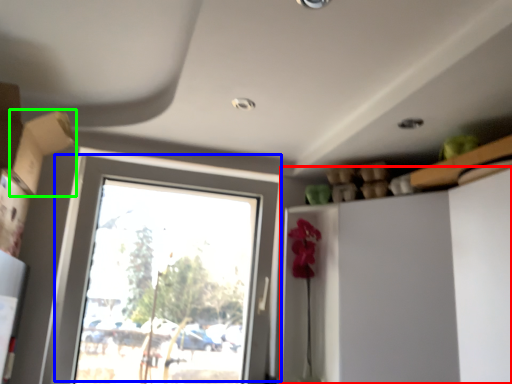
Question: Based on their relative distances, which object is nearer to dresser (highlighted by a red box)? Choose from window (highlighted by a blue box) and cardboard box (highlighted by a green box).

Choices:
 (A) window
 (B) cardboard box

Answer: (A)